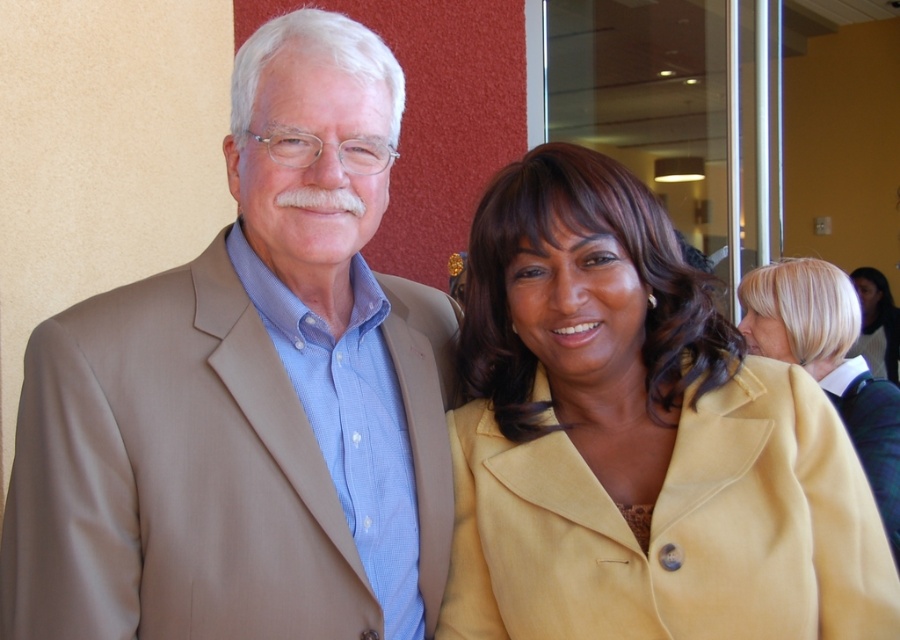
Question: Is yellow suede jacket at center positioned before blonde hair at upper right?

Choices:
 (A) no
 (B) yes

Answer: (B)

Question: Observing the image, what is the correct spatial positioning of tan fabric suit at left in reference to blonde hair at upper right?

Choices:
 (A) below
 (B) above

Answer: (B)

Question: Which object is the farthest from the blonde hair at upper right?

Choices:
 (A) yellow suede jacket at center
 (B) matte yellow coat at center

Answer: (B)

Question: Can you confirm if yellow suede jacket at center is wider than matte yellow coat at center?

Choices:
 (A) no
 (B) yes

Answer: (A)

Question: Which of the following is the closest to the observer?

Choices:
 (A) (352, 192)
 (B) (813, 572)

Answer: (A)

Question: Which point appears closest to the camera in this image?

Choices:
 (A) (640, 268)
 (B) (362, 333)
 (C) (888, 336)

Answer: (A)